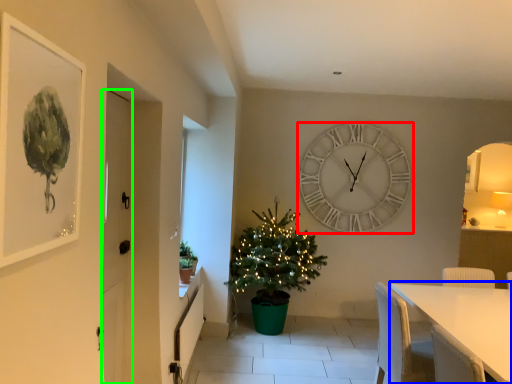
Question: Considering the real-world distances, which object is farthest from wall clock (highlighted by a red box)? table (highlighted by a blue box) or door (highlighted by a green box)?

Choices:
 (A) table
 (B) door

Answer: (B)